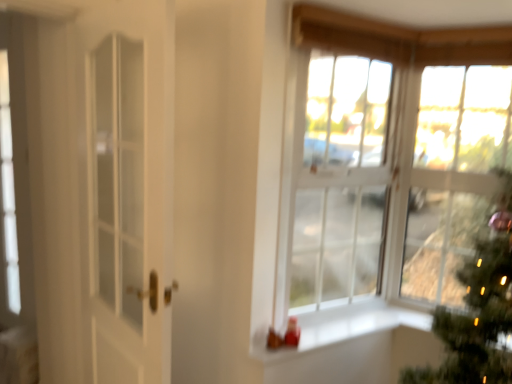
Identify the location of free space above clear glass window at upper right, arranged as the 3th window when viewed from the front (from a real-world perspective). (465, 72).